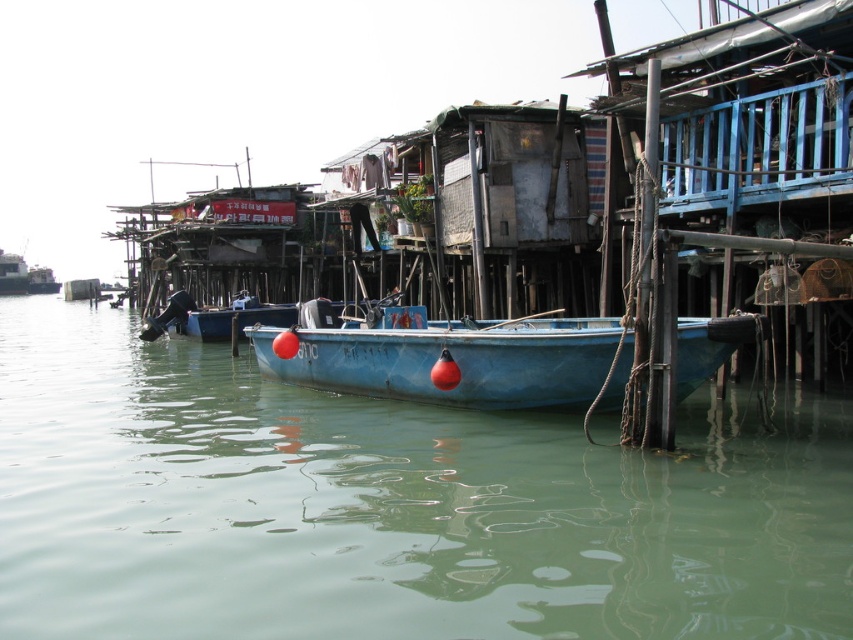
Looking at this image, between green matte water at center and blue matte boat at center, which one is positioned higher?

blue matte boat at center is higher up.

Locate an element on the screen. This screenshot has height=640, width=853. green matte water at center is located at coordinates (389, 506).

Is point (399, 582) positioned behind point (693, 321)?

No, (399, 582) is in front of (693, 321).

Find the location of a particular element. green matte water at center is located at coordinates (389, 506).